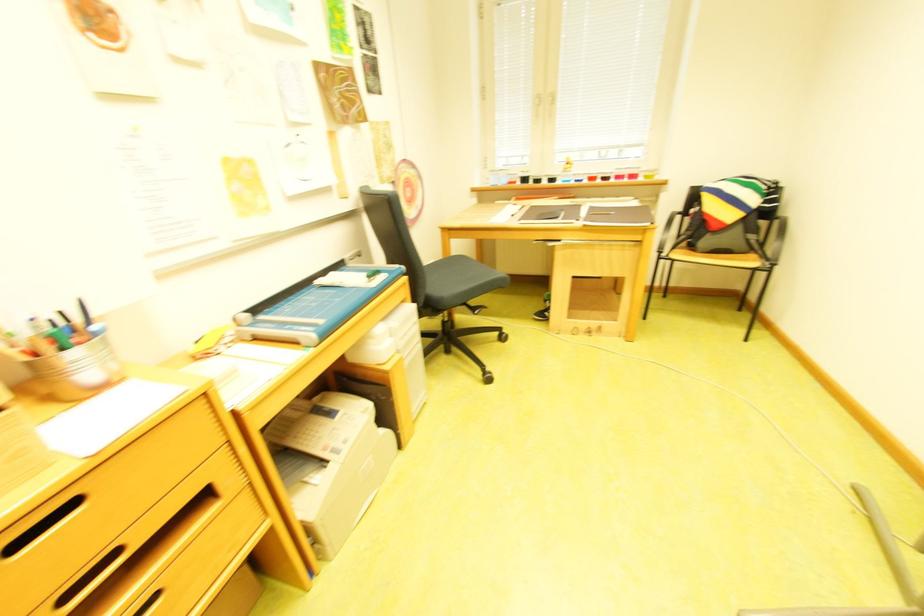
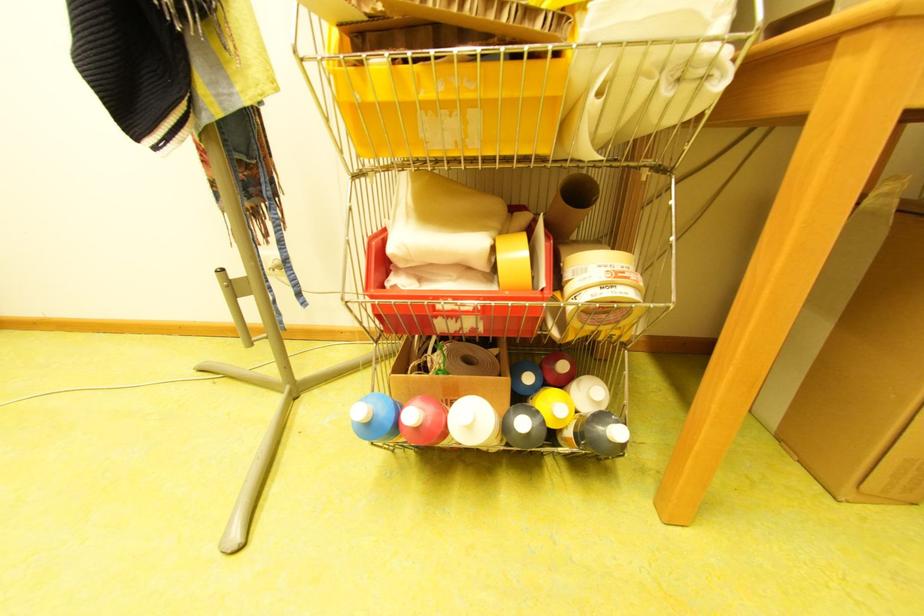
The first image is from the beginning of the video and the second image is from the end. How did the camera likely rotate when shooting the video?

The camera's rotation is toward right-down.